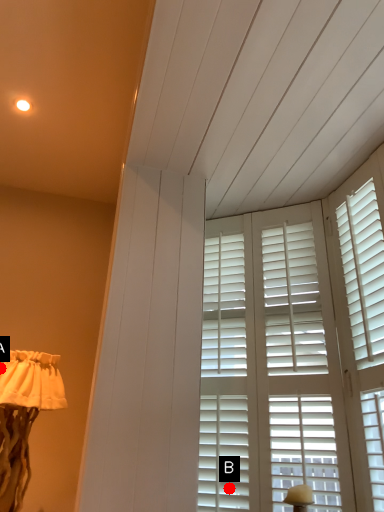
Question: Two points are circled on the image, labeled by A and B beside each circle. Which of the following is the farthest from the observer?

Choices:
 (A) A is further
 (B) B is further

Answer: (A)